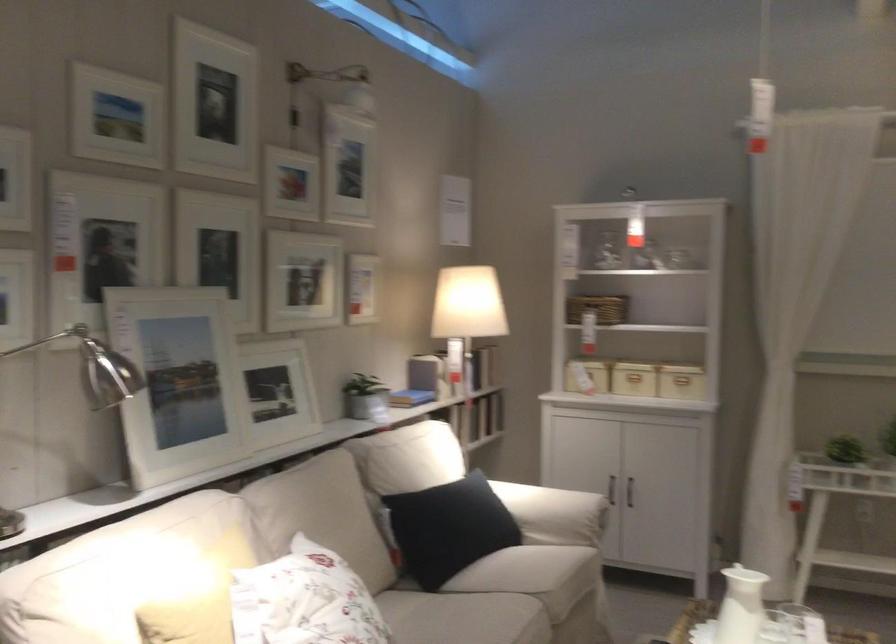
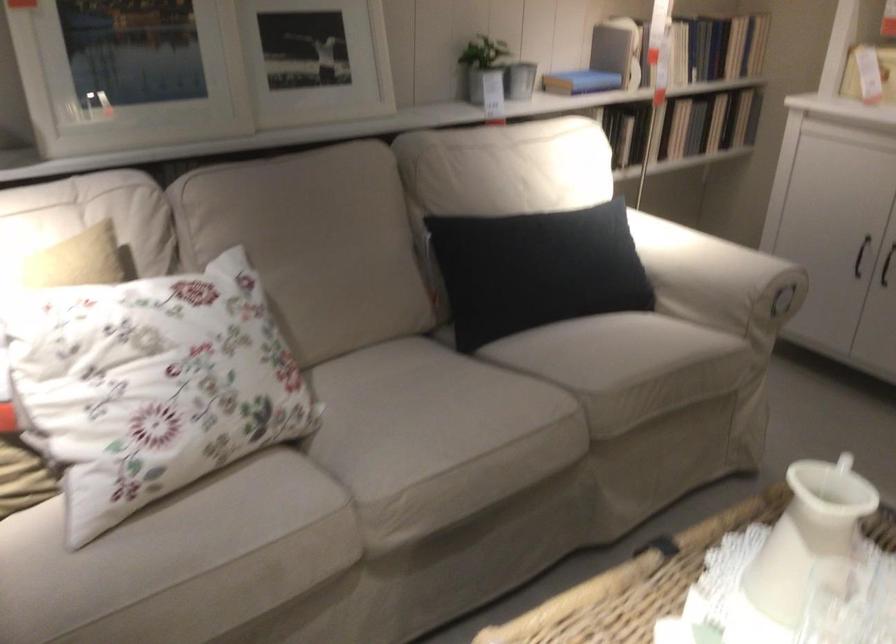
Locate, in the second image, the point that corresponds to point (462, 527) in the first image.

(536, 270)